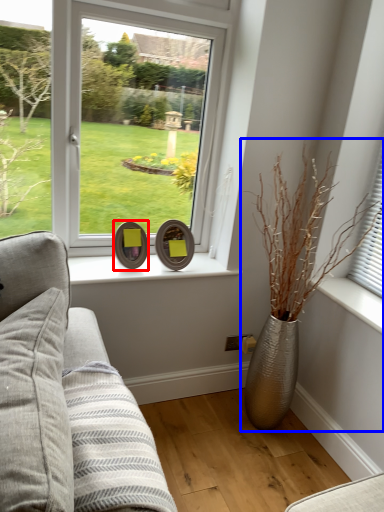
Question: Which object is closer to the camera taking this photo, picture frame (highlighted by a red box) or houseplant (highlighted by a blue box)?

Choices:
 (A) picture frame
 (B) houseplant

Answer: (B)